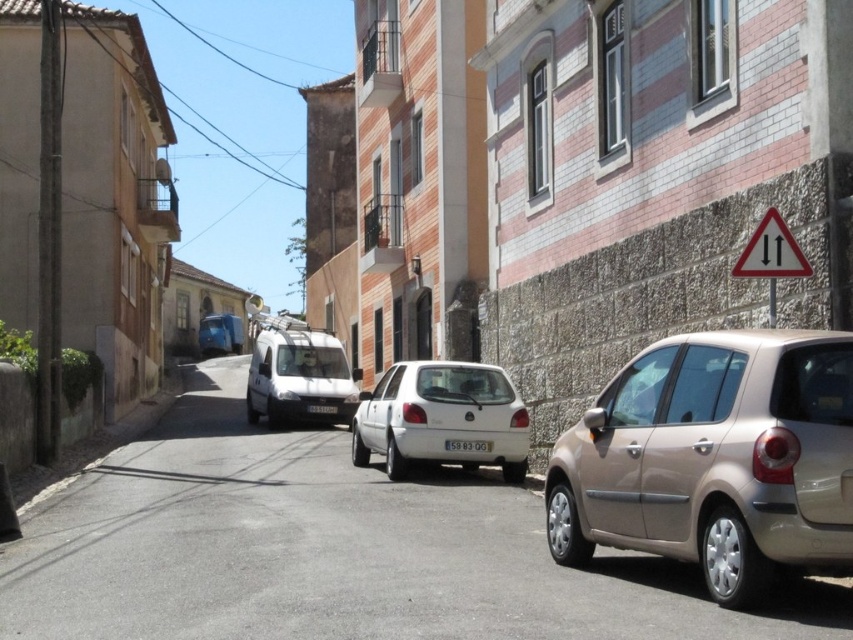
Question: Which object appears farthest from the camera in this image?

Choices:
 (A) white matte hatchback at center
 (B) white triangular sign at upper right
 (C) white matte car at center

Answer: (A)

Question: Is white matte hatchback at center further to camera compared to white matte van at center?

Choices:
 (A) yes
 (B) no

Answer: (B)

Question: Does gold metallic hatchback at right have a larger size compared to metallic blue van at center?

Choices:
 (A) yes
 (B) no

Answer: (A)

Question: Which point is closer to the camera?

Choices:
 (A) white triangular sign at upper right
 (B) metallic blue van at center
 (C) white plastic license plate at center

Answer: (A)

Question: Among these points, which one is farthest from the camera?

Choices:
 (A) (421, 412)
 (B) (331, 412)

Answer: (B)

Question: Is white matte van at center thinner than metallic blue van at center?

Choices:
 (A) yes
 (B) no

Answer: (B)